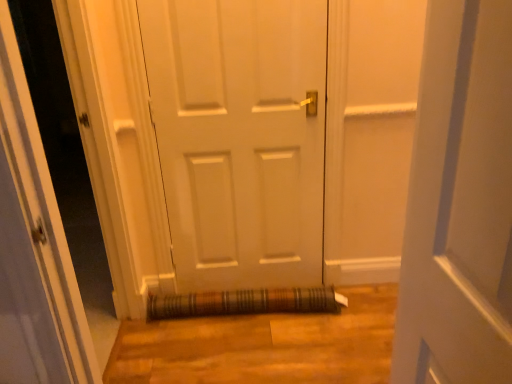
Question: Does white matte door at center touch transparent glass door at center?

Choices:
 (A) no
 (B) yes

Answer: (A)

Question: From a real-world perspective, is white matte door at center under transparent glass door at center?

Choices:
 (A) no
 (B) yes

Answer: (B)

Question: Does white matte door at center have a greater width compared to transparent glass door at center?

Choices:
 (A) yes
 (B) no

Answer: (B)

Question: Does white matte door at center have a greater height compared to transparent glass door at center?

Choices:
 (A) no
 (B) yes

Answer: (B)

Question: Is white matte door at center aimed at transparent glass door at center?

Choices:
 (A) no
 (B) yes

Answer: (A)

Question: Considering the positions of brown woven mat at lower center and white matte door at center in the image, is brown woven mat at lower center bigger or smaller than white matte door at center?

Choices:
 (A) big
 (B) small

Answer: (B)

Question: In the image, is brown woven mat at lower center on the left side or the right side of white matte door at center?

Choices:
 (A) right
 (B) left

Answer: (A)

Question: From the image's perspective, relative to white matte door at center, is brown woven mat at lower center above or below?

Choices:
 (A) above
 (B) below

Answer: (B)

Question: Considering the positions of point (183, 304) and point (287, 274), is point (183, 304) closer or farther from the camera than point (287, 274)?

Choices:
 (A) farther
 (B) closer

Answer: (B)

Question: Is white matte door at center inside or outside of transparent glass door at center?

Choices:
 (A) inside
 (B) outside

Answer: (B)

Question: From the image's perspective, relative to transparent glass door at center, is white matte door at center above or below?

Choices:
 (A) below
 (B) above

Answer: (B)

Question: Considering the positions of white matte door at center and transparent glass door at center in the image, is white matte door at center bigger or smaller than transparent glass door at center?

Choices:
 (A) big
 (B) small

Answer: (B)

Question: Does point (291, 284) appear closer or farther from the camera than point (45, 344)?

Choices:
 (A) farther
 (B) closer

Answer: (A)

Question: Based on their sizes in the image, would you say white matte door at center is bigger or smaller than brown woven mat at lower center?

Choices:
 (A) small
 (B) big

Answer: (B)

Question: In the image, is white matte door at center on the left side or the right side of brown woven mat at lower center?

Choices:
 (A) right
 (B) left

Answer: (B)